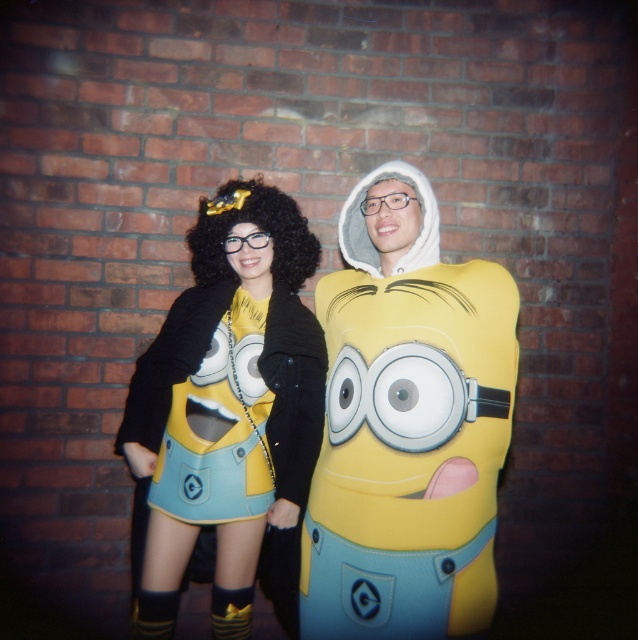
Is matte yellow costume at center above matte yellow dress at center?

Correct, matte yellow costume at center is located above matte yellow dress at center.

Is the position of matte yellow costume at center less distant than that of matte yellow dress at center?

Yes, it is.

Who is more forward, (452, 604) or (234, 593)?

Point (452, 604) is in front.

The height and width of the screenshot is (640, 638). Find the location of `matte yellow costume at center`. matte yellow costume at center is located at coordinates (406, 424).